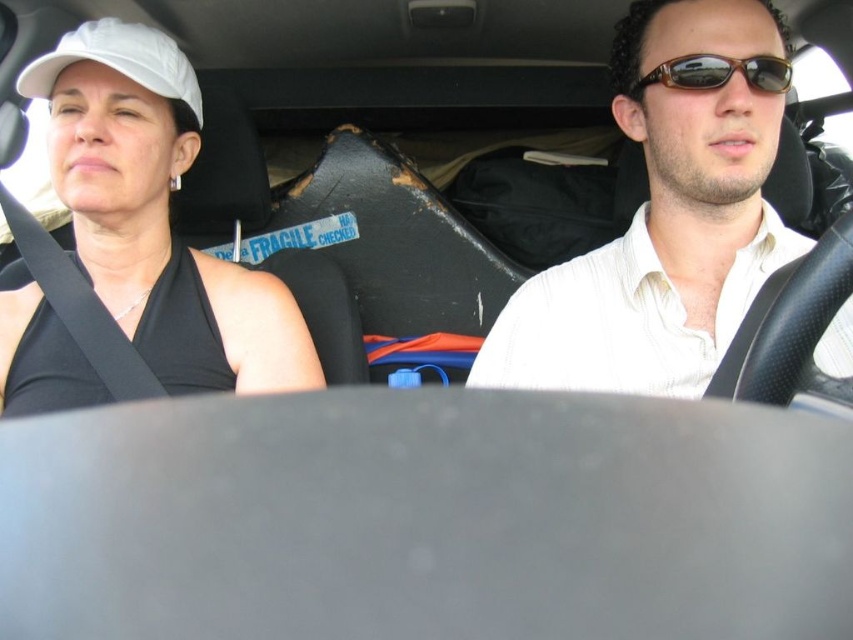
Is white shirt at center behind brown tortoiseshell sunglasses at upper center?

No, it is not.

Does white shirt at center have a greater width compared to brown tortoiseshell sunglasses at upper center?

Yes, white shirt at center is wider than brown tortoiseshell sunglasses at upper center.

This screenshot has width=853, height=640. What do you see at coordinates (664, 220) in the screenshot?
I see `white shirt at center` at bounding box center [664, 220].

Identify the location of white shirt at center. (664, 220).

Can you confirm if white shirt at center is positioned to the left of white matte baseball cap at upper left?

Incorrect, white shirt at center is not on the left side of white matte baseball cap at upper left.

Based on the photo, between white shirt at center and white matte baseball cap at upper left, which one appears on the left side from the viewer's perspective?

white matte baseball cap at upper left

Is point (693, 232) farther from viewer compared to point (167, 72)?

That is False.

Identify the location of white shirt at center. The image size is (853, 640). (664, 220).

Does matte black tank top at left have a larger size compared to white matte baseball cap at upper left?

Indeed, matte black tank top at left has a larger size compared to white matte baseball cap at upper left.

Does matte black tank top at left have a smaller size compared to white matte baseball cap at upper left?

Actually, matte black tank top at left might be larger than white matte baseball cap at upper left.

Locate an element on the screen. This screenshot has height=640, width=853. matte black tank top at left is located at coordinates pos(138,243).

Locate an element on the screen. The image size is (853, 640). matte black tank top at left is located at coordinates pos(138,243).